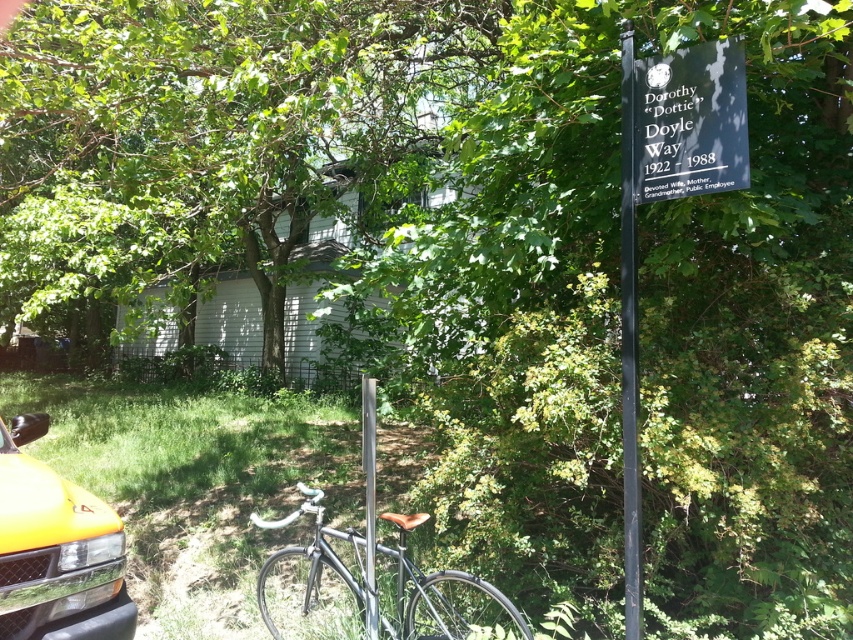
You are a photographer setting up a shot of the street sign. You need to ensure the black metal signpost at upper right and the silver metallic pole at center are both in frame. Which object should you position to the right side of the other?

The black metal signpost at upper right is positioned on the right side of the silver metallic pole at center, so you should ensure the black metal signpost at upper right is to the right of the silver metallic pole at center in your composition.

You are a delivery person needing to park your delivery van which is 10 feet long. You see the yellow matte car at lower left and the shiny black bicycle at center. Is there enough space between them to park your van?

The yellow matte car at lower left is 3.67 feet from the shiny black bicycle at center. Since the van is 10 feet long, there is not enough space between them to park the van.

You are a delivery person who needs to park your shiny black bicycle at center near the black metal signpost at upper right. Can you park it to the right side of the signpost without moving it from its current position?

The shiny black bicycle at center is already positioned to the left of the black metal signpost at upper right, so you can park it to the right side of the signpost without moving it from its current position.